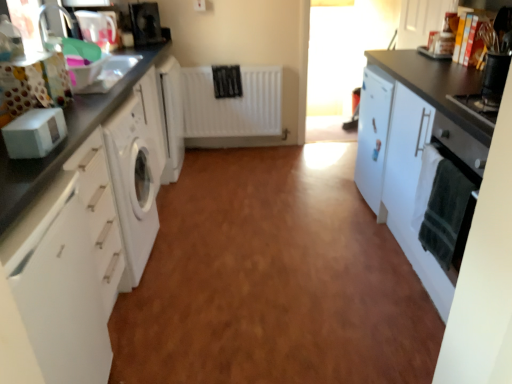
Where is `free space to the right of white glossy jug at upper left, which is the 3th appliance from front to back`? This screenshot has width=512, height=384. free space to the right of white glossy jug at upper left, which is the 3th appliance from front to back is located at coordinates (130, 50).